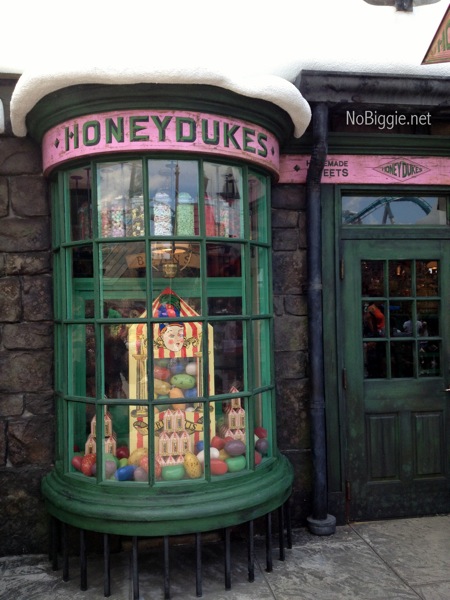
The width and height of the screenshot is (450, 600). In order to click on door hinges in this screenshot , I will do `click(342, 271)`, `click(343, 382)`.